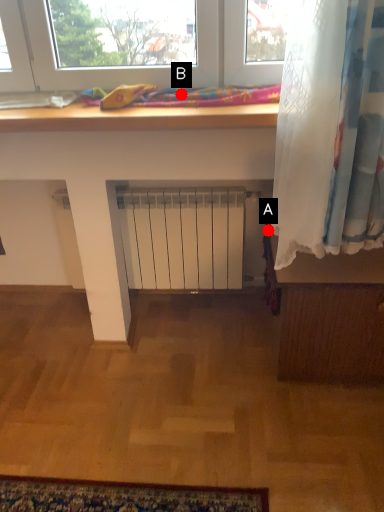
Question: Two points are circled on the image, labeled by A and B beside each circle. Which of the following is the closest to the observer?

Choices:
 (A) A is closer
 (B) B is closer

Answer: (B)